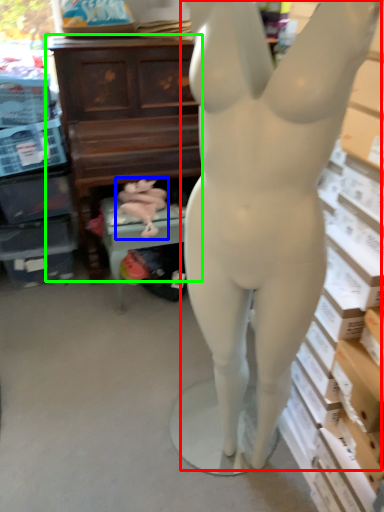
Question: Estimate the real-world distances between objects in this image. Which object is farther from person (highlighted by a red box), animal sculpture (highlighted by a blue box) or entertainment center (highlighted by a green box)?

Choices:
 (A) animal sculpture
 (B) entertainment center

Answer: (B)